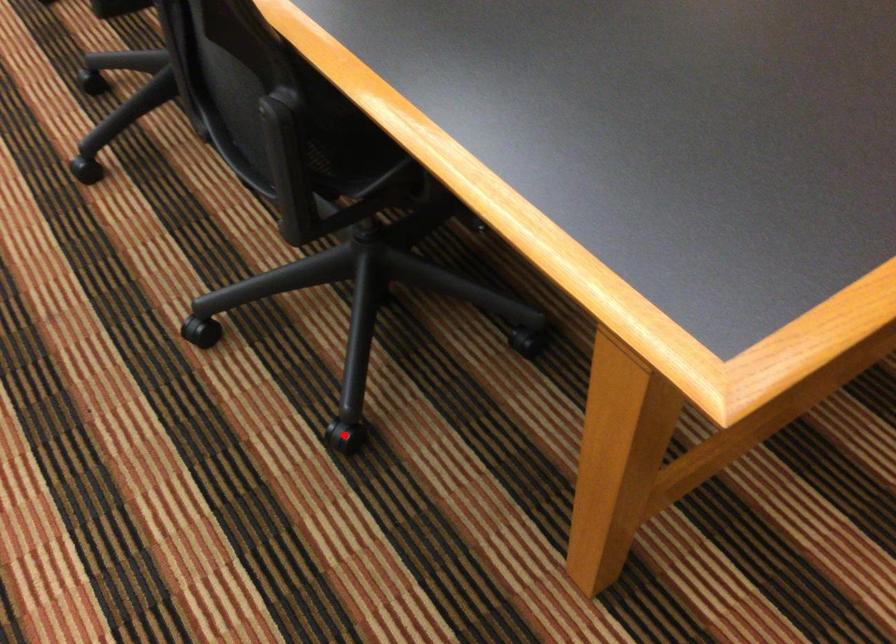
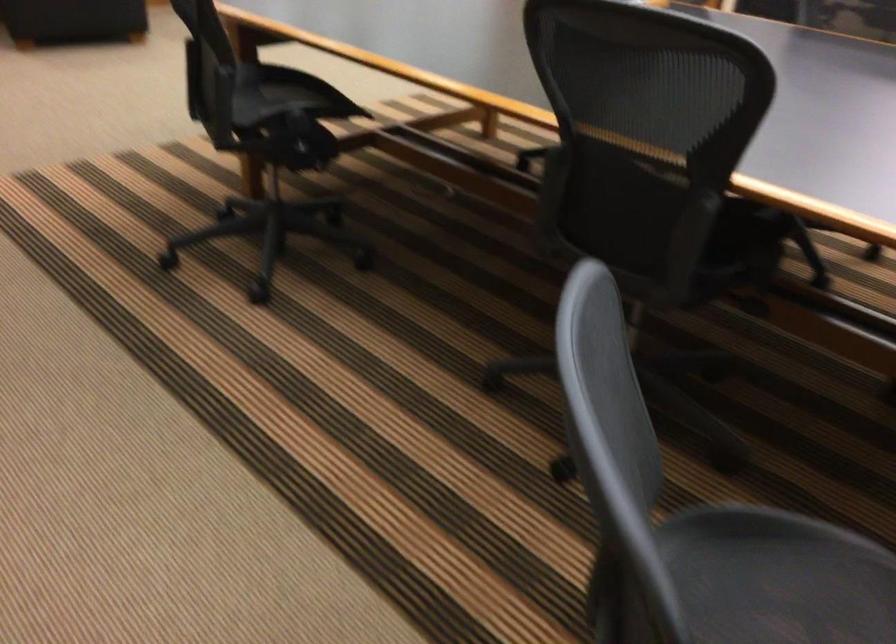
Question: I am providing you with two images of the same scene from different viewpoints. A red point is marked on the first image. Can you still see the location of the red point in image 2?

Choices:
 (A) Yes
 (B) No

Answer: (B)